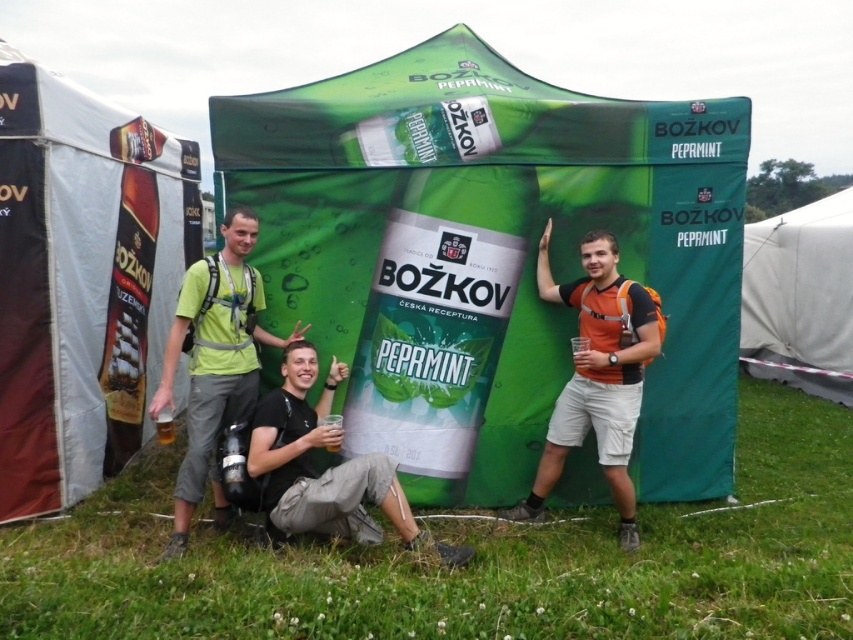
Question: Can you confirm if green fabric tent at center is bigger than green fabric backpack at center?

Choices:
 (A) no
 (B) yes

Answer: (B)

Question: Can you confirm if green fabric backpack at center is thinner than matte black t-shirt at center?

Choices:
 (A) no
 (B) yes

Answer: (B)

Question: Which object is farther from the camera taking this photo?

Choices:
 (A) green fabric tent at center
 (B) black fabric tent at left

Answer: (B)

Question: Does black fabric tent at left have a lesser width compared to matte black t-shirt at center?

Choices:
 (A) no
 (B) yes

Answer: (B)

Question: Which of the following is the farthest from the observer?

Choices:
 (A) green grass at lower center
 (B) matte black t-shirt at center
 (C) white fabric tent at lower right

Answer: (C)

Question: Among these objects, which one is nearest to the camera?

Choices:
 (A) orange fabric backpack at right
 (B) white fabric tent at lower right

Answer: (A)